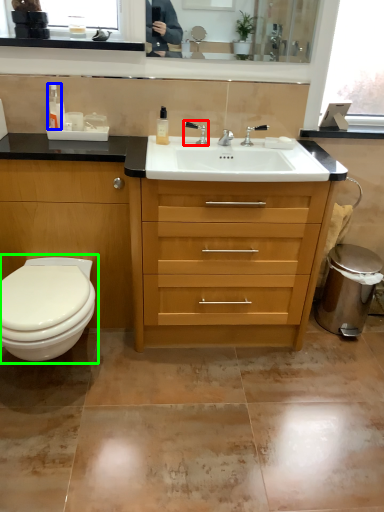
Question: Considering the real-world distances, which object is closest to faucet (highlighted by a red box)? toiletry (highlighted by a blue box) or toilet (highlighted by a green box).

Choices:
 (A) toiletry
 (B) toilet

Answer: (A)